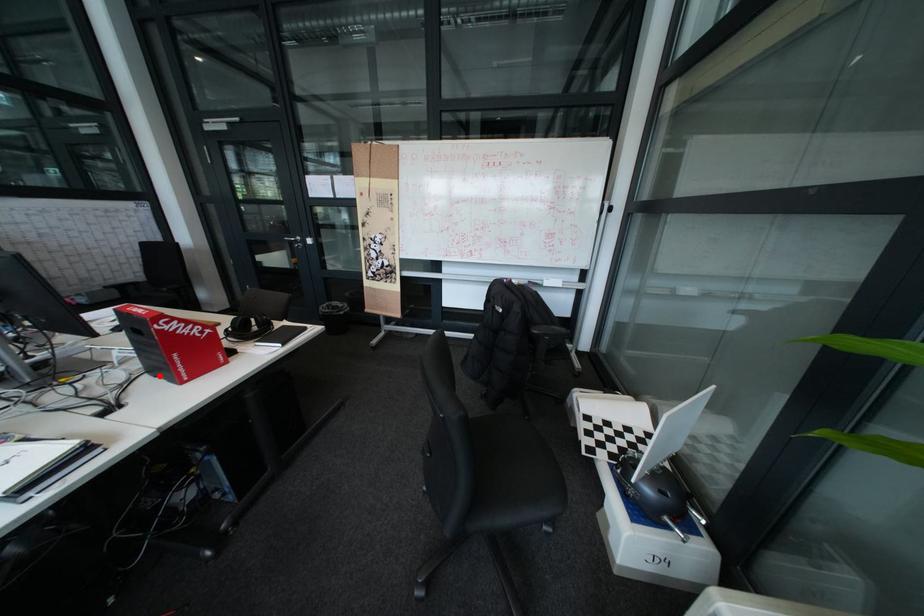
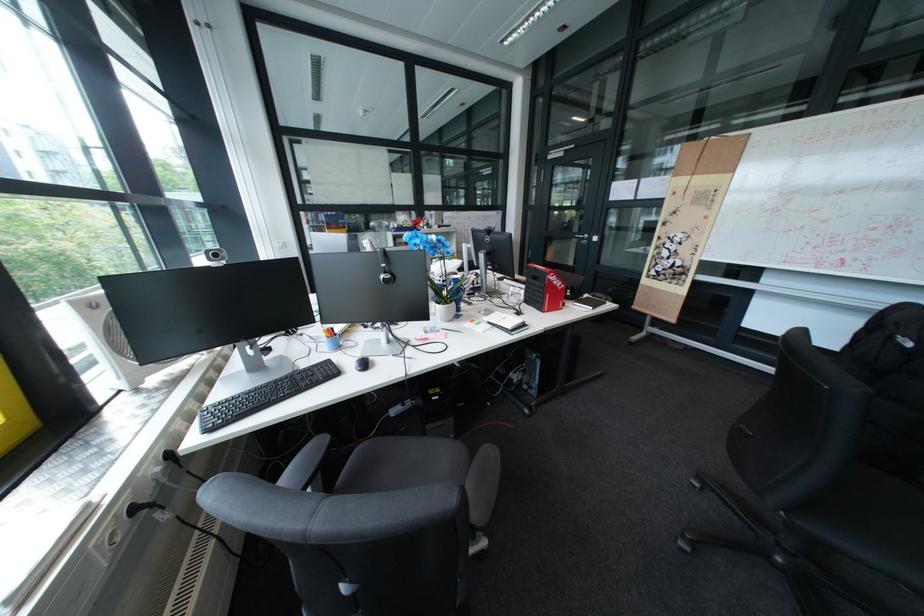
In the second image, find the point that corresponds to the highlighted location in the first image.

(538, 304)